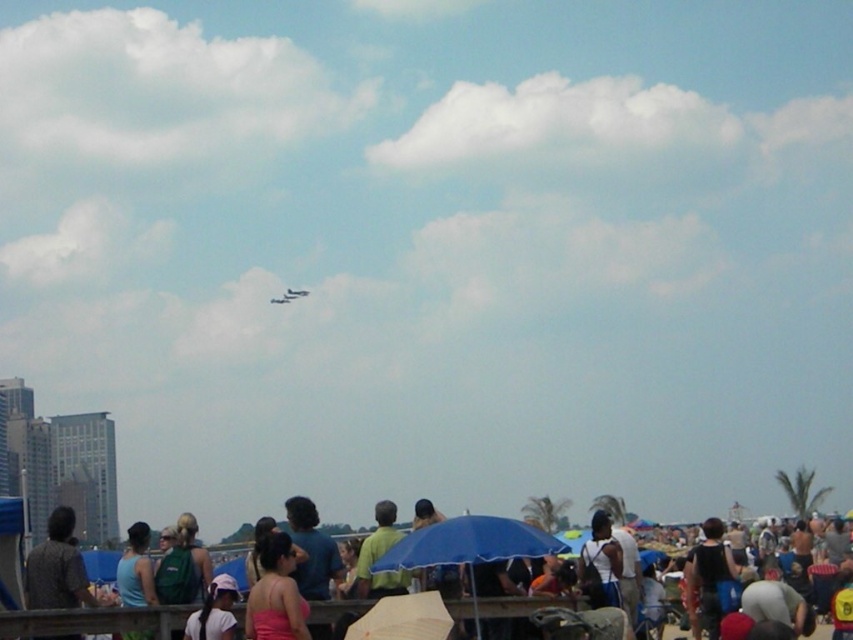
You are a photographer at the waterfront event. You want to take a photo of the metallic silver airplane at upper center without any people in the frame. Is the pink fabric dress at center blocking your view of the airplane?

The pink fabric dress at center is below the metallic silver airplane at upper center, so the airplane is above the dress. Therefore, the dress is not blocking the view of the airplane.

You are a photographer trying to capture a photo of the green fabric shirt at center without the blue matte umbrella at center blocking it. What should you do?

The blue matte umbrella at center is larger than the green fabric shirt at center, so to avoid the umbrella blocking the shirt, you should move your camera position to the side or adjust your angle to ensure the smaller green fabric shirt at center is framed away from the larger blue matte umbrella at center.